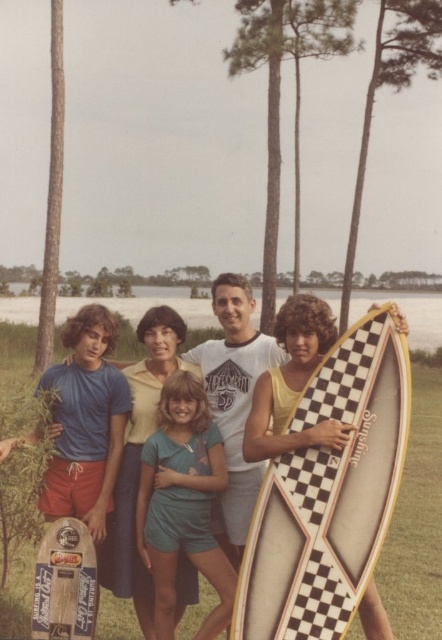
Does checkerboard-patterned surfboard at center have a greater height compared to matte black surfboard at center?

Yes.

Which is more to the left, checkerboard-patterned surfboard at center or matte black surfboard at center?

matte black surfboard at center

Locate an element on the screen. Image resolution: width=442 pixels, height=640 pixels. checkerboard-patterned surfboard at center is located at coordinates (324, 477).

Identify the location of checkerboard-patterned surfboard at center. (324, 477).

Between matte black surfboard at center and white checkered surfboard at center, which one has less height?

With less height is matte black surfboard at center.

Does point (102, 308) come farther from viewer compared to point (41, 637)?

Yes, it is behind point (41, 637).

Where is `matte black surfboard at center`? The width and height of the screenshot is (442, 640). matte black surfboard at center is located at coordinates (233, 310).

Is point (353, 552) positioned after point (54, 636)?

No, (353, 552) is closer to viewer.

Based on the photo, could you measure the distance between checkerboard-patterned surfboard at center and white checkered surfboard at center?

They are 1.69 meters apart.

Between point (346, 404) and point (83, 579), which one is positioned behind?

The point (83, 579) is more distant.

At what (x,y) coordinates should I click in order to perform the action: click on checkerboard-patterned surfboard at center. Please return your answer as a coordinate pair (x, y). The height and width of the screenshot is (640, 442). Looking at the image, I should click on (324, 477).